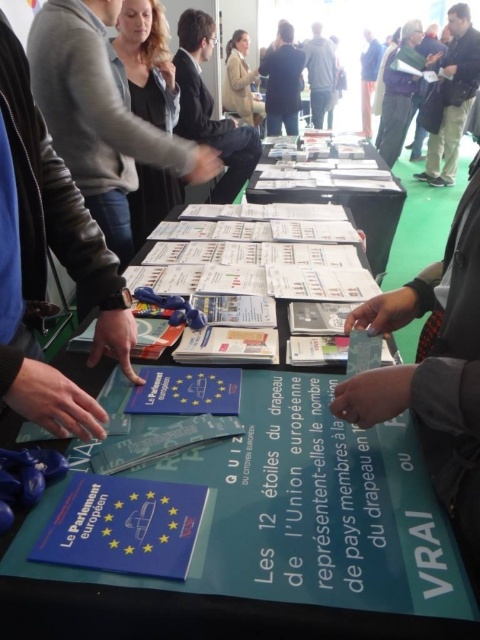
You are at an event about the European Parliament and see two jackets displayed on the table. The gray fabric jacket at upper center and the blue fabric jacket at upper center. Which one is shorter in height?

The gray fabric jacket at upper center has a lesser height compared to the blue fabric jacket at upper center, so the gray fabric jacket at upper center is shorter.

You are at the event and want to borrow a jacket from the table. The gray fabric jacket at upper center and the blue fabric jacket at upper center are both on the table. Which jacket would you need to move first to access the one underneath?

The gray fabric jacket at upper center is in front of the blue fabric jacket at upper center, so you would need to move the gray fabric jacket at upper center first to access the one underneath.